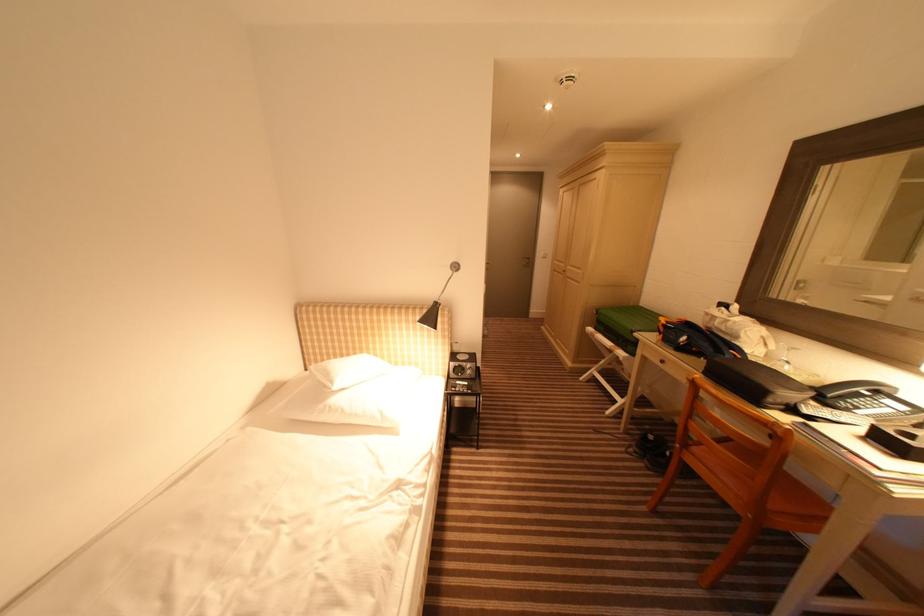
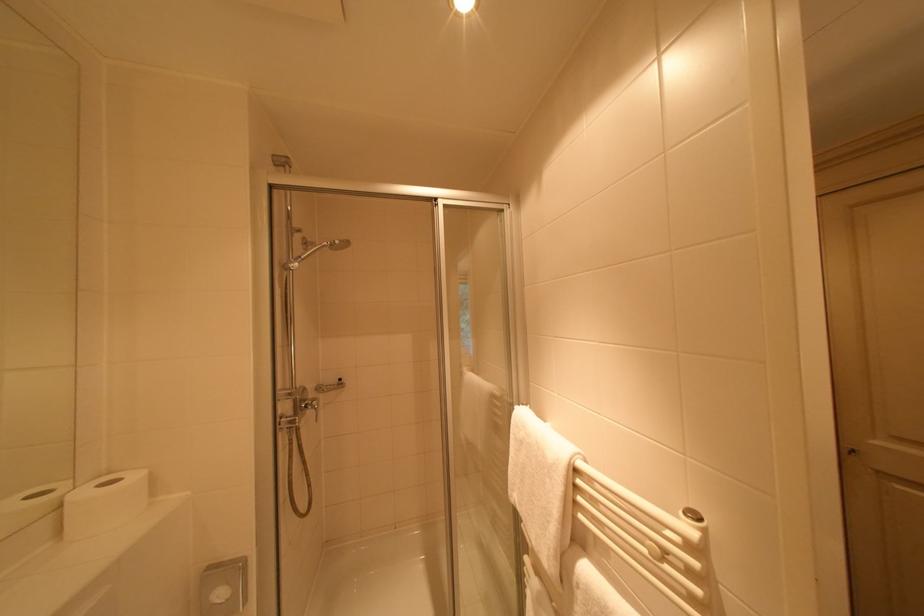
Question: What movement of the cameraman would produce the second image?

Choices:
 (A) Left
 (B) Right
 (C) Forward
 (D) Backward

Answer: (C)